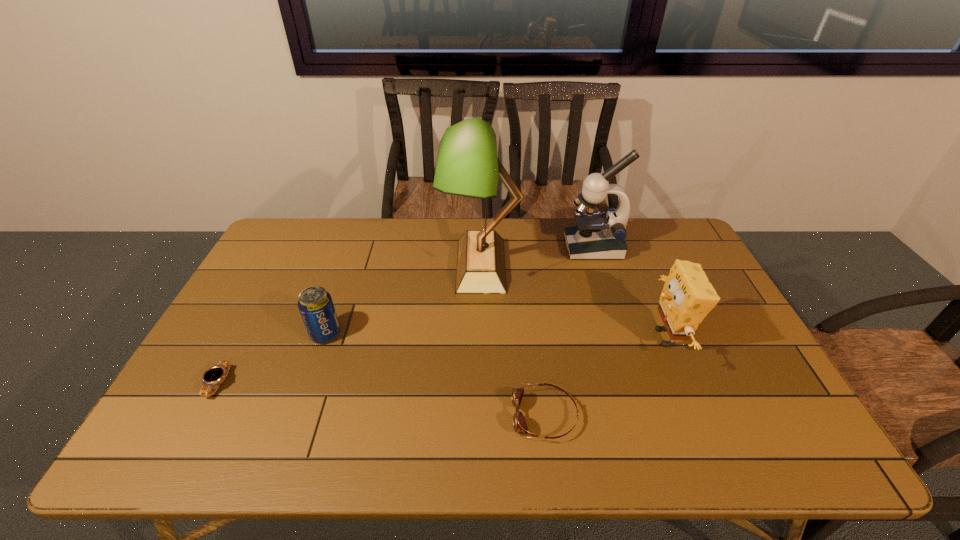
You are a GUI agent. You are given a task and a screenshot of the screen. Output one action in this format:
    pyautogui.click(x=<x>, y=<y>)
    Task: Click on the vacant area located on the metallic stand of the table lamp
    The width and height of the screenshot is (960, 540).
    Given the screenshot: What is the action you would take?
    pyautogui.click(x=340, y=265)

Locate an element on the screen. The height and width of the screenshot is (540, 960). vacant space situated on the left of the second tallest object is located at coordinates tap(543, 247).

You are a GUI agent. You are given a task and a screenshot of the screen. Output one action in this format:
    pyautogui.click(x=<x>, y=<y>)
    Task: Click on the vacant space located on the face of the fourth shortest object
    This screenshot has width=960, height=540.
    Given the screenshot: What is the action you would take?
    pyautogui.click(x=544, y=338)

The image size is (960, 540). In order to click on free space located 0.090m on the face of the fourth shortest object in this screenshot , I will do (613, 338).

Where is `free region located 0.150m on the face of the fourth shortest object`? The width and height of the screenshot is (960, 540). free region located 0.150m on the face of the fourth shortest object is located at coordinates (591, 338).

At what (x,y) coordinates should I click in order to perform the action: click on vacant space located 0.320m on the right of the fourth tallest object. Please return your answer as a coordinate pair (x, y). This screenshot has width=960, height=540. Looking at the image, I should click on (456, 334).

Locate an element on the screen. The height and width of the screenshot is (540, 960). free space located through the lenses of the fifth tallest object is located at coordinates (436, 415).

Locate an element on the screen. vacant space located 0.260m through the lenses of the fifth tallest object is located at coordinates (401, 415).

Where is `vacant position located through the lenses of the fifth tallest object`? vacant position located through the lenses of the fifth tallest object is located at coordinates (436, 415).

Where is `free location located 0.220m on the back of the leftmost object`? The image size is (960, 540). free location located 0.220m on the back of the leftmost object is located at coordinates (260, 307).